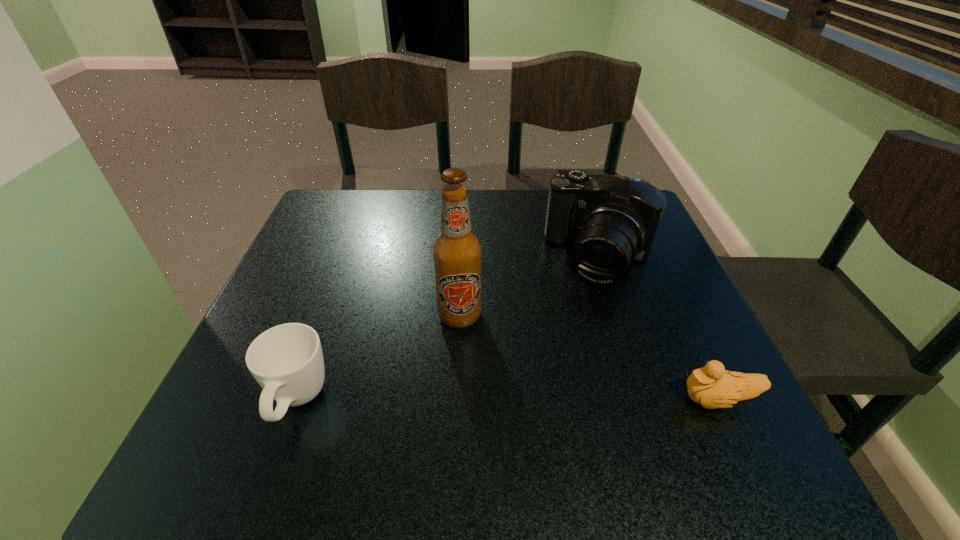
Image resolution: width=960 pixels, height=540 pixels. Find the location of `camera located at the right edge`. camera located at the right edge is located at coordinates (613, 219).

The height and width of the screenshot is (540, 960). In order to click on object that is at the near left corner in this screenshot , I will do `click(287, 361)`.

At what (x,y) coordinates should I click in order to perform the action: click on object that is positioned at the far right corner. Please return your answer as a coordinate pair (x, y). Image resolution: width=960 pixels, height=540 pixels. Looking at the image, I should click on (613, 219).

This screenshot has width=960, height=540. What are the coordinates of `object at the near right corner` in the screenshot? It's located at click(x=712, y=386).

This screenshot has height=540, width=960. In order to click on free region at the far edge of the desktop in this screenshot , I will do [x=513, y=198].

Where is `free point at the near edge`? free point at the near edge is located at coordinates (340, 387).

In the image, there is a desktop. Where is `free space at the left edge`? The image size is (960, 540). free space at the left edge is located at coordinates (333, 257).

Where is `vacant space at the right edge of the desktop`? The width and height of the screenshot is (960, 540). vacant space at the right edge of the desktop is located at coordinates (640, 376).

This screenshot has height=540, width=960. Identify the location of free point at the far left corner. (312, 212).

Image resolution: width=960 pixels, height=540 pixels. In order to click on vacant region at the near left corner of the desktop in this screenshot , I will do `click(258, 389)`.